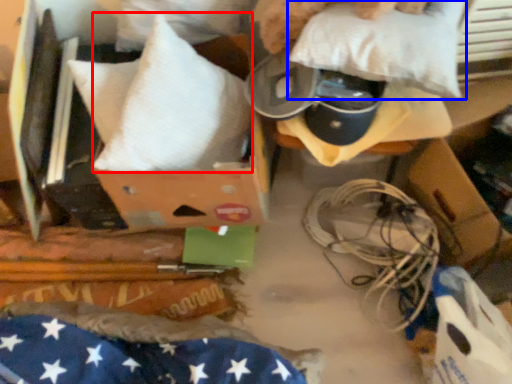
Question: Which object is further to the camera taking this photo, pillow (highlighted by a red box) or pillow (highlighted by a blue box)?

Choices:
 (A) pillow
 (B) pillow

Answer: (A)